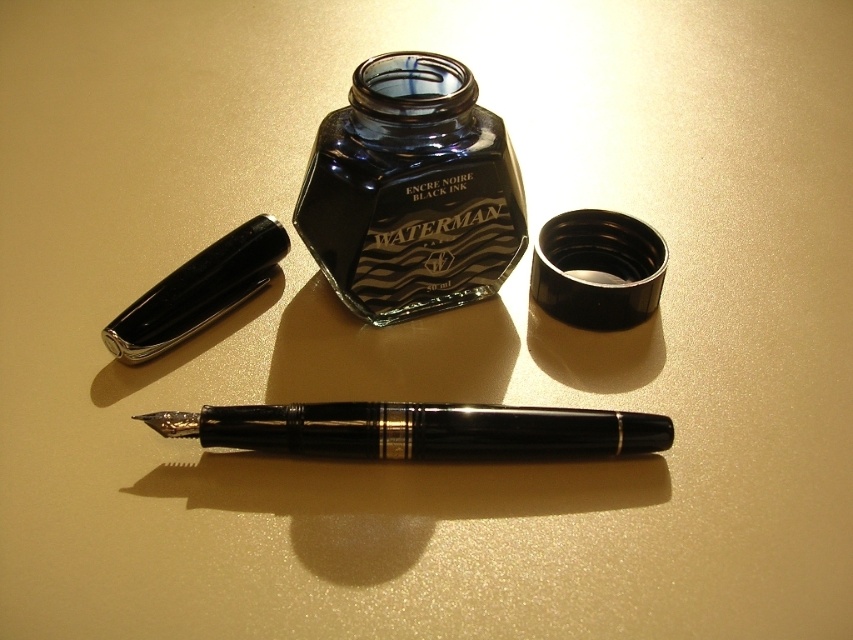
Is black glass bottle at center above glossy black pen at upper left?

Correct, black glass bottle at center is located above glossy black pen at upper left.

Can you confirm if black glass bottle at center is positioned below glossy black pen at upper left?

Incorrect, black glass bottle at center is not positioned below glossy black pen at upper left.

Is point (474, 134) positioned in front of point (222, 296)?

Yes, it is in front of point (222, 296).

The height and width of the screenshot is (640, 853). I want to click on black glass bottle at center, so click(410, 192).

Is black glass bottle at center behind black polished pen at center?

Yes, it is.

Between point (346, 216) and point (283, 426), which one is positioned in front?

Point (283, 426) is in front.

Which is behind, point (364, 124) or point (366, 436)?

The point (364, 124) is behind.

Locate an element on the screen. This screenshot has height=640, width=853. black glass bottle at center is located at coordinates (410, 192).

Can you confirm if black polished pen at center is thinner than glossy black pen at upper left?

Incorrect, black polished pen at center's width is not less than glossy black pen at upper left's.

Based on the photo, who is lower down, black polished pen at center or glossy black pen at upper left?

black polished pen at center is below.

The height and width of the screenshot is (640, 853). Find the location of `black polished pen at center`. black polished pen at center is located at coordinates (419, 429).